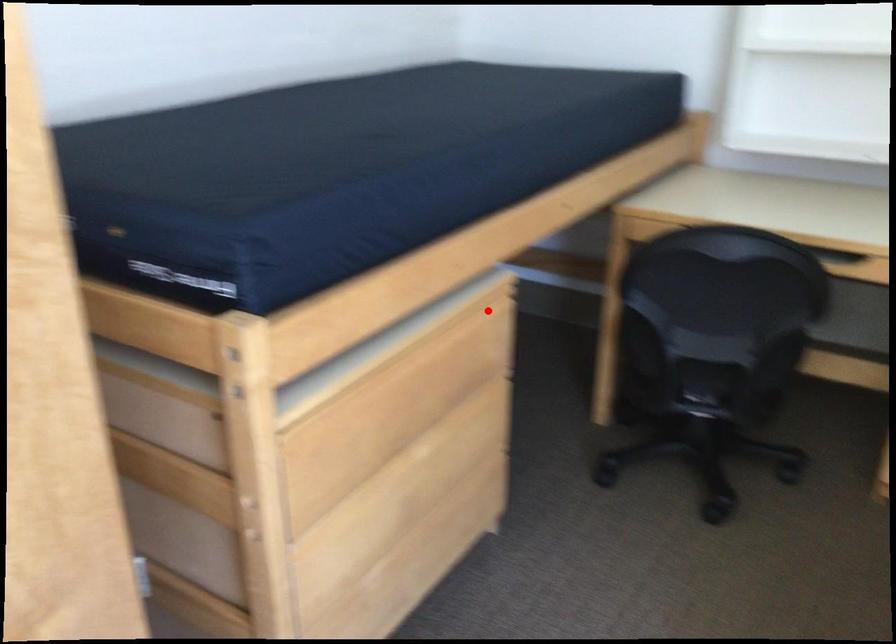
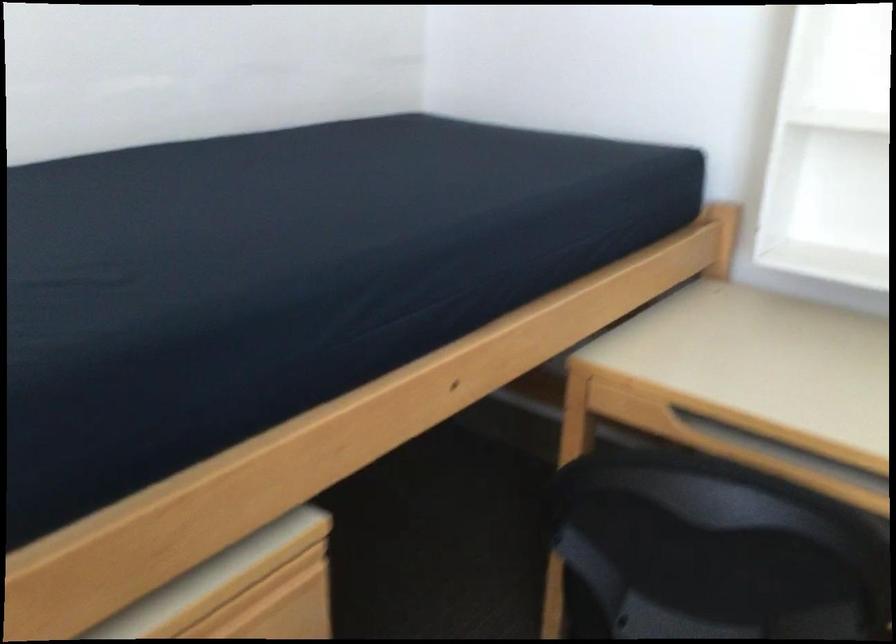
Where in the second image is the point corresponding to the highlighted location from the first image?

(277, 581)